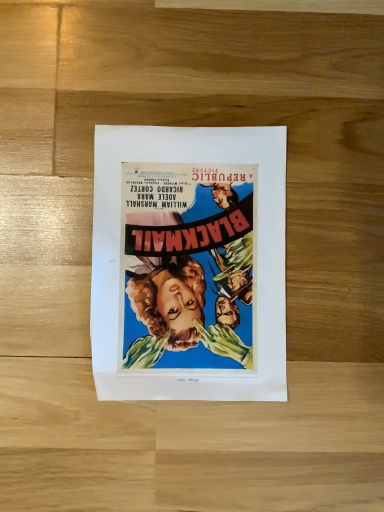
This screenshot has width=384, height=512. What are the coordinates of `free space above matte paper poster at center (from a real-world perspective)` in the screenshot? It's located at (188, 254).